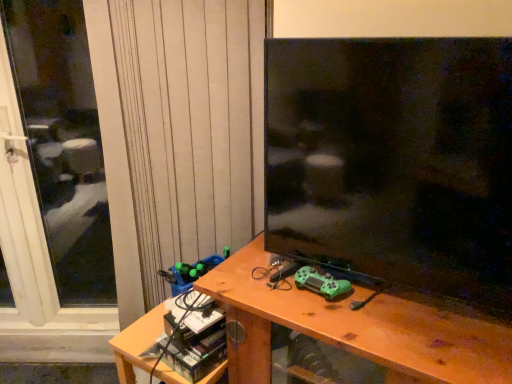
Question: Would you say white textured curtain at upper left is outside matte black tv at center?

Choices:
 (A) no
 (B) yes

Answer: (B)

Question: Is the position of white textured curtain at upper left less distant than that of matte black tv at center?

Choices:
 (A) no
 (B) yes

Answer: (A)

Question: Could matte black tv at center be considered to be inside white textured curtain at upper left?

Choices:
 (A) yes
 (B) no

Answer: (B)

Question: Considering the relative sizes of white textured curtain at upper left and matte black tv at center in the image provided, is white textured curtain at upper left taller than matte black tv at center?

Choices:
 (A) yes
 (B) no

Answer: (A)

Question: Is white textured curtain at upper left far away from matte black tv at center?

Choices:
 (A) yes
 (B) no

Answer: (B)

Question: Considering the relative sizes of white textured curtain at upper left and matte black tv at center in the image provided, is white textured curtain at upper left bigger than matte black tv at center?

Choices:
 (A) yes
 (B) no

Answer: (A)

Question: Does matte black tv at center have a smaller size compared to wooden desk at center?

Choices:
 (A) no
 (B) yes

Answer: (B)

Question: From a real-world perspective, does matte black tv at center sit lower than wooden desk at center?

Choices:
 (A) no
 (B) yes

Answer: (A)

Question: Does matte black tv at center have a lesser height compared to wooden desk at center?

Choices:
 (A) no
 (B) yes

Answer: (B)

Question: Can we say matte black tv at center lies outside wooden desk at center?

Choices:
 (A) no
 (B) yes

Answer: (B)

Question: Is matte black tv at center to the right of wooden desk at center from the viewer's perspective?

Choices:
 (A) yes
 (B) no

Answer: (A)

Question: Does matte black tv at center have a greater width compared to wooden desk at center?

Choices:
 (A) no
 (B) yes

Answer: (A)

Question: Does wooden desk at center come in front of transparent glass screen door at left?

Choices:
 (A) no
 (B) yes

Answer: (B)